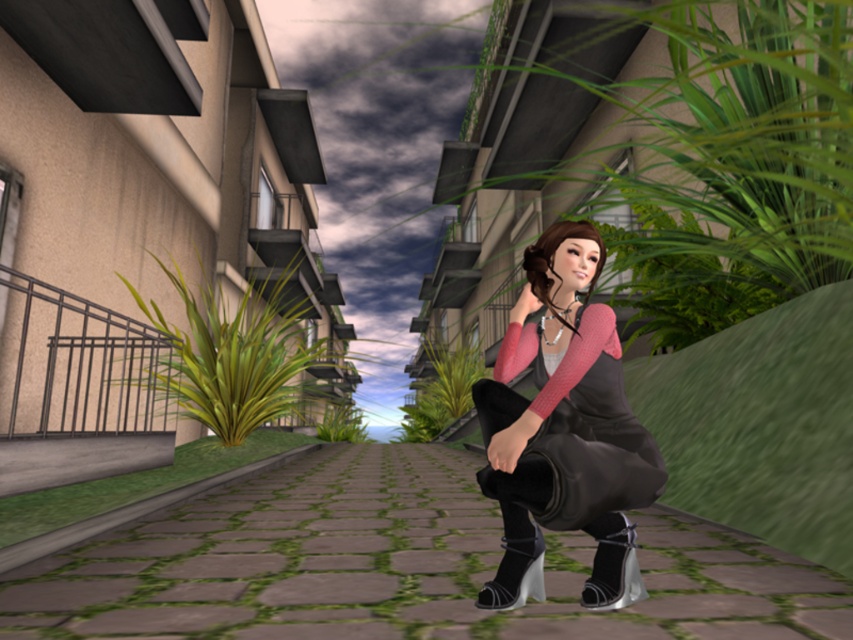
Consider the image. You are a character in the game who needs to choose between the shiny silver boot at lower center and the black leather boot at lower center for a mission. Which boot is smaller in size?

The shiny silver boot at lower center is smaller in size compared to the black leather boot at lower center.